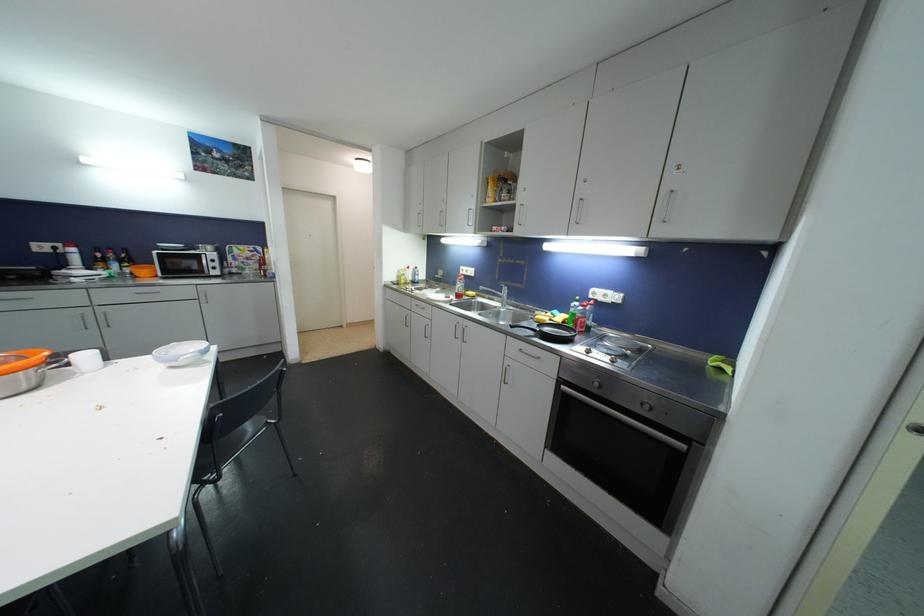
Where would you turn the stove control knob? Please return your answer as a coordinate pair (x, y).

(646, 406)